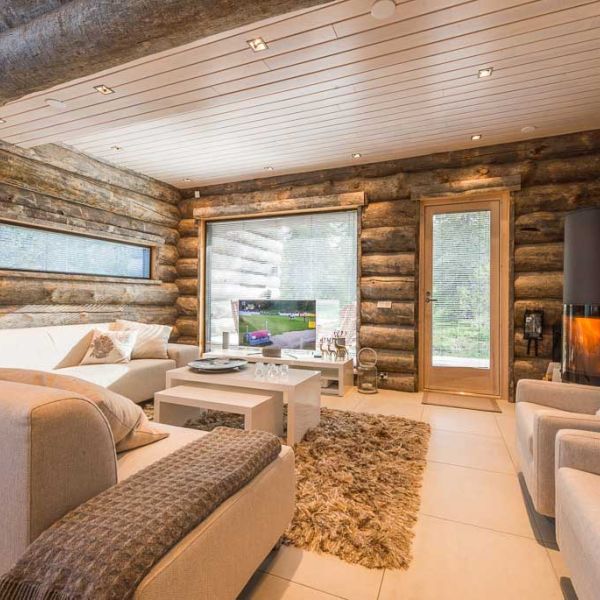
The width and height of the screenshot is (600, 600). Identify the location of 2 single chairs. (541, 432), (566, 476).